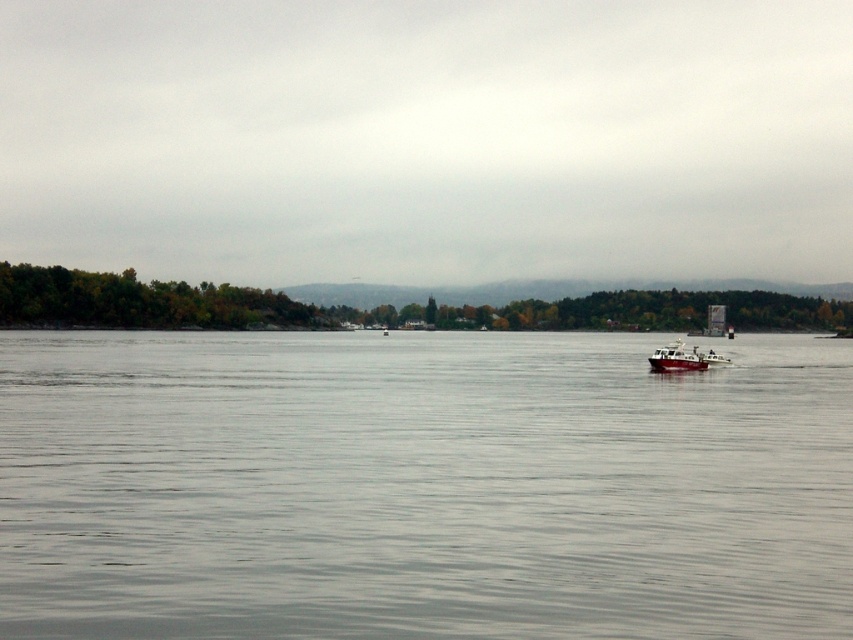
Does transparent water at center lie in front of white plastic boat at right?

Yes.

Can you confirm if transparent water at center is shorter than white plastic boat at right?

Incorrect, transparent water at center's height does not fall short of white plastic boat at right's.

At what (x,y) coordinates should I click in order to perform the action: click on transparent water at center. Please return your answer as a coordinate pair (x, y). Looking at the image, I should click on (421, 484).

Does red matte boat at center have a lesser height compared to white plastic boat at right?

Incorrect, red matte boat at center's height does not fall short of white plastic boat at right's.

Between point (672, 348) and point (727, 358), which one is positioned behind?

The point (727, 358) is behind.

At what (x,y) coordinates should I click in order to perform the action: click on red matte boat at center. Please return your answer as a coordinate pair (x, y). The width and height of the screenshot is (853, 640). Looking at the image, I should click on (676, 358).

Is transparent water at center shorter than red matte boat at center?

In fact, transparent water at center may be taller than red matte boat at center.

Does transparent water at center have a smaller size compared to red matte boat at center?

No, transparent water at center is not smaller than red matte boat at center.

Between point (798, 445) and point (659, 353), which one is positioned behind?

Point (659, 353)

This screenshot has width=853, height=640. I want to click on transparent water at center, so click(421, 484).